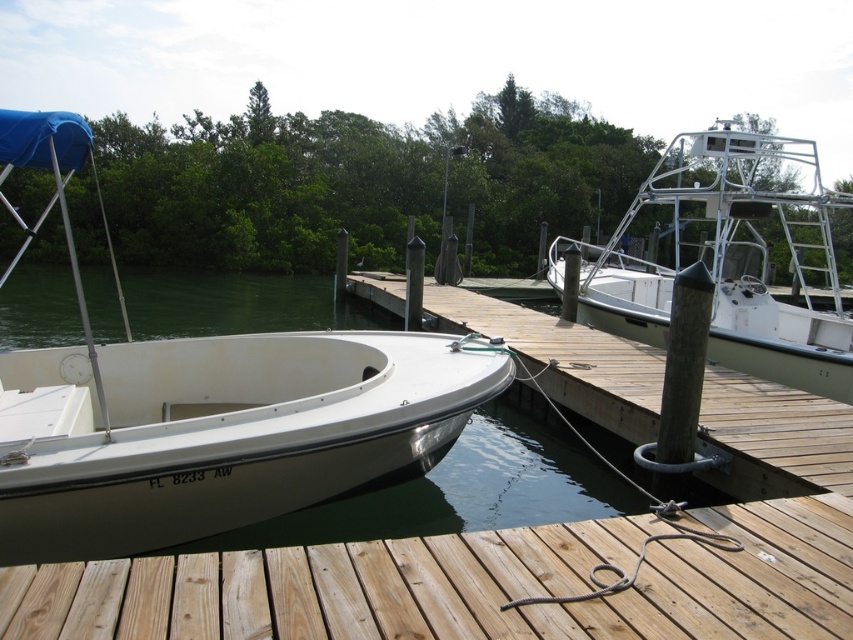
Question: Can you confirm if white matte boat at left is bigger than light brown wood at lower center?

Choices:
 (A) yes
 (B) no

Answer: (A)

Question: Is white matte boat at left positioned in front of white metallic boat at upper right?

Choices:
 (A) yes
 (B) no

Answer: (A)

Question: Does white matte boat at left appear over white metallic boat at upper right?

Choices:
 (A) yes
 (B) no

Answer: (B)

Question: Estimate the real-world distances between objects in this image. Which object is farther from the wooden dock at lower center?

Choices:
 (A) white metallic boat at upper right
 (B) white matte boat at left

Answer: (A)

Question: Which object is positioned closest to the white matte boat at left?

Choices:
 (A) wooden dock at lower center
 (B) light brown wood at lower center
 (C) white metallic boat at upper right

Answer: (A)

Question: Which point is closer to the camera?

Choices:
 (A) (404, 374)
 (B) (779, 211)
 (C) (744, 531)
 (D) (614, 528)

Answer: (C)